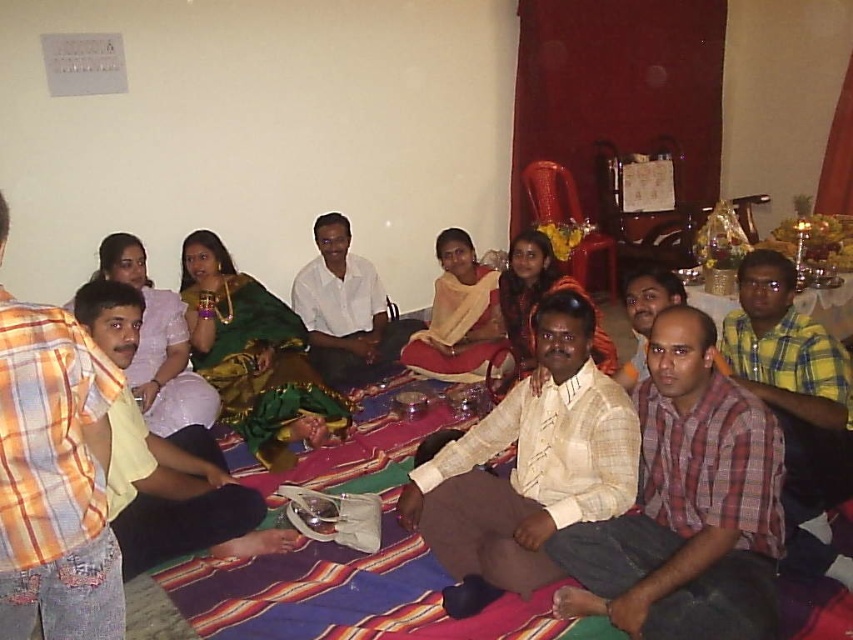
Question: Which point is closer to the camera?

Choices:
 (A) matte white cloth at center
 (B) yellow plaid shirt at left
 (C) light beige textured shirt at center
 (D) plaid cotton shirt at center

Answer: (D)

Question: Which of the following is the closest to the observer?

Choices:
 (A) (524, 429)
 (B) (799, 368)
 (C) (659, 344)
 (D) (722, 625)

Answer: (D)

Question: Can you confirm if light beige textured shirt at center is thinner than white cotton shirt at center?

Choices:
 (A) yes
 (B) no

Answer: (B)

Question: Can you confirm if plaid cotton shirt at center is wider than yellow plaid shirt at lower right?

Choices:
 (A) yes
 (B) no

Answer: (A)

Question: Which point is farther from the camera taking this photo?

Choices:
 (A) (97, 513)
 (B) (309, 353)
 (C) (131, 536)

Answer: (B)

Question: Is plaid cotton shirt at center further to camera compared to yellow plaid shirt at lower right?

Choices:
 (A) no
 (B) yes

Answer: (A)